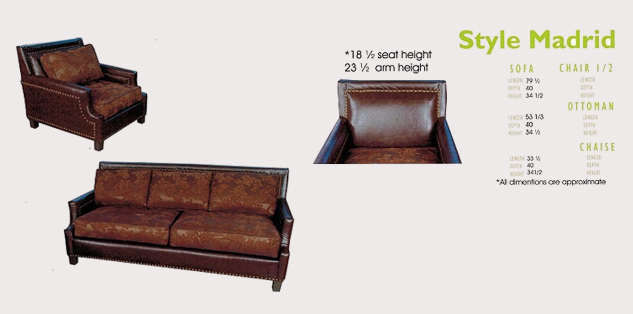
Where is `right front chair leg`? This screenshot has height=314, width=633. right front chair leg is located at coordinates (99, 149).